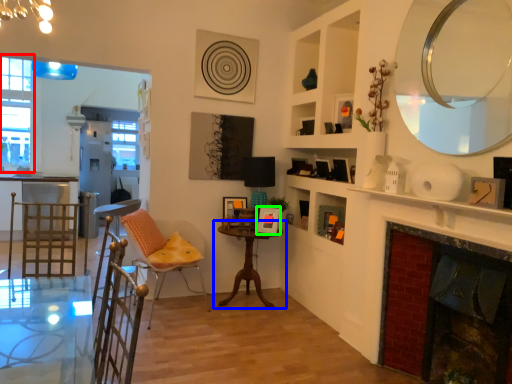
Question: Based on their relative distances, which object is nearer to window (highlighted by a red box)? Choose from table (highlighted by a blue box) and picture frame (highlighted by a green box).

Choices:
 (A) table
 (B) picture frame

Answer: (A)